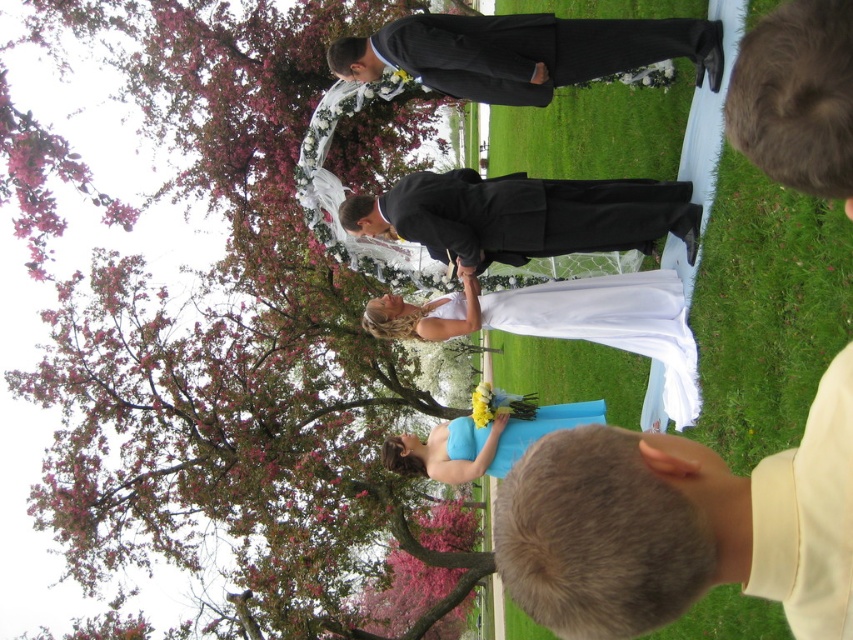
You are a GUI agent. You are given a task and a screenshot of the screen. Output one action in this format:
    pyautogui.click(x=<x>, y=<y>)
    Task: Click on the pink blossoming tree at upper left
    
    Given the screenshot: What is the action you would take?
    pyautogui.click(x=228, y=340)

Describe the element at coordinates (228, 340) in the screenshot. I see `pink blossoming tree at upper left` at that location.

Between point (408, 166) and point (587, 634), which one is positioned behind?

The point (408, 166) is more distant.

This screenshot has height=640, width=853. Find the location of `pink blossoming tree at upper left`. pink blossoming tree at upper left is located at coordinates (228, 340).

Who is more distant from viewer, [645,204] or [399,56]?

Point [399,56]

What do you see at coordinates (524, 216) in the screenshot? I see `black satin suit at center` at bounding box center [524, 216].

Which is in front, point (462, 168) or point (469, 33)?

Point (469, 33) is more forward.

The height and width of the screenshot is (640, 853). What are the coordinates of `black satin suit at center` in the screenshot? It's located at coord(524,216).

Can you confirm if pink blossoming tree at upper left is positioned below black pinstripe suit at center?

Indeed, pink blossoming tree at upper left is positioned under black pinstripe suit at center.

The width and height of the screenshot is (853, 640). I want to click on pink blossoming tree at upper left, so click(228, 340).